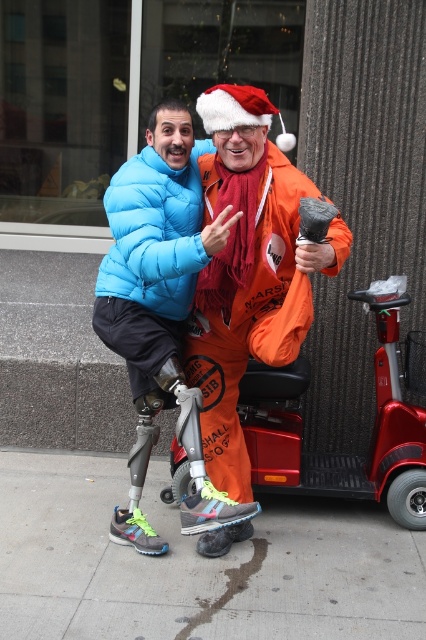
Does point (166, 568) lie in front of point (127, 317)?

No.

Between point (302, 540) and point (173, 364), which one is positioned in front?

Point (173, 364) is more forward.

Does point (396, 636) lie in front of point (115, 333)?

Yes.

The width and height of the screenshot is (426, 640). What are the coordinates of `gray concrete sidewalk at center` in the screenshot? It's located at (195, 564).

Does orange fabric santa hat at center have a lesser width compared to blue puffer jacket at center?

No.

Find the location of a particular element. The image size is (426, 640). orange fabric santa hat at center is located at coordinates (249, 272).

Between point (238, 252) and point (143, 291), which one is positioned behind?

The point (143, 291) is more distant.

This screenshot has width=426, height=640. I want to click on orange fabric santa hat at center, so click(x=249, y=272).

Can you confirm if gray concrete sidewalk at center is positioned above orange fabric santa hat at center?

Incorrect, gray concrete sidewalk at center is not positioned above orange fabric santa hat at center.

Is gray concrete sidewalk at center shorter than orange fabric santa hat at center?

Yes.

The height and width of the screenshot is (640, 426). Describe the element at coordinates (195, 564) in the screenshot. I see `gray concrete sidewalk at center` at that location.

The height and width of the screenshot is (640, 426). Identify the location of gray concrete sidewalk at center. (195, 564).